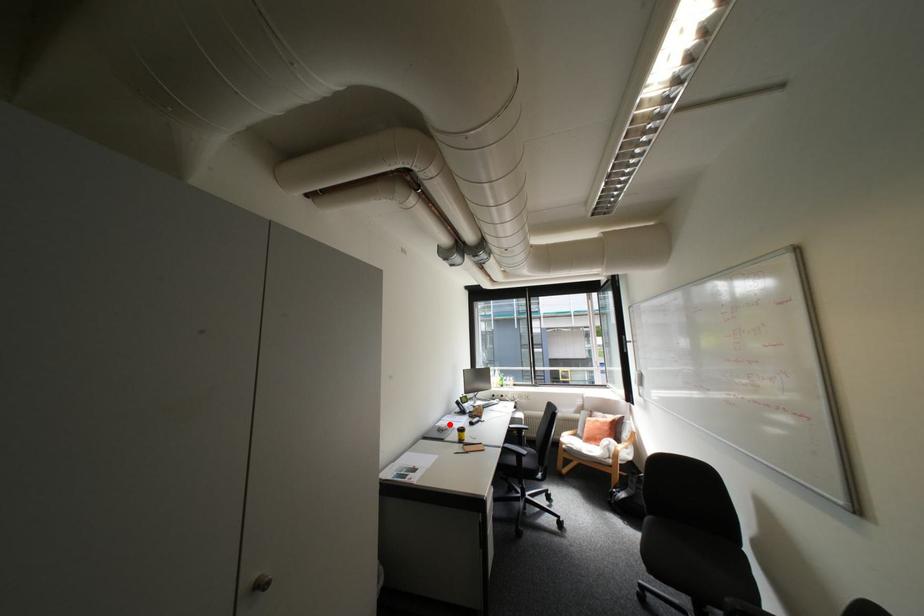
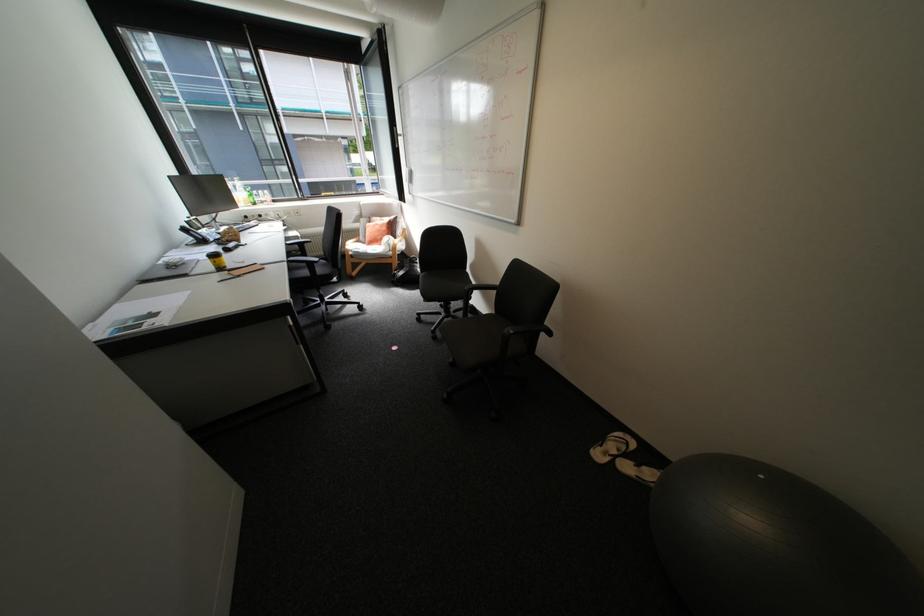
Locate, in the second image, the point that corresponds to the highlighted location in the first image.

(176, 260)